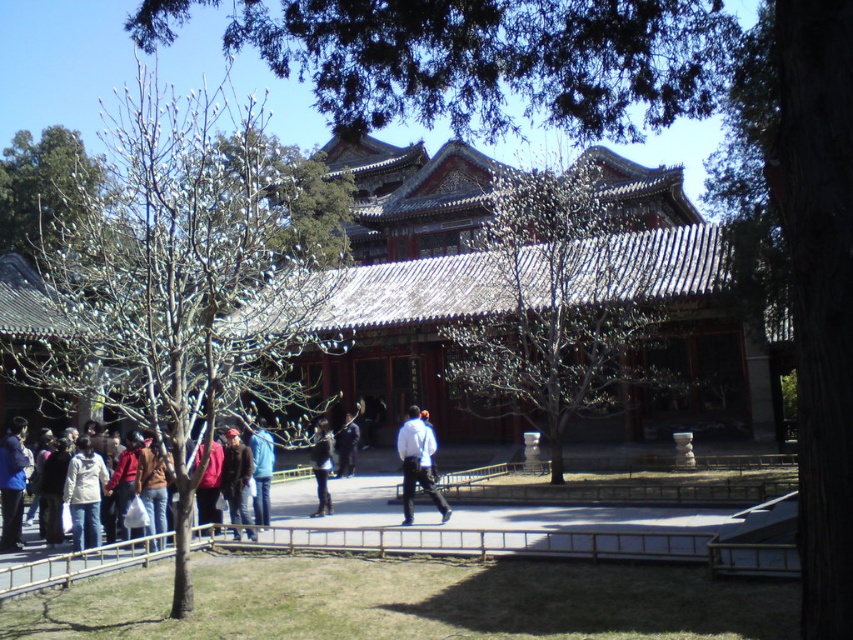
You are standing in front of a traditional Chinese building and see the bare branches at left and the black matte jacket at center. Which object is located to the left of the other?

The bare branches at left is positioned on the left side of black matte jacket at center.

You are a photographer planning to take a picture of the traditional Chinese building. You notice the bare branches at left and the black matte jacket at center in your frame. Which object should you adjust your camera angle to avoid blocking the building? Explain your reasoning based on their sizes.

The bare branches at left is larger in size than the black matte jacket at center. Therefore, to avoid blocking the building, you should adjust your camera angle to move the larger bare branches at left out of the frame first.